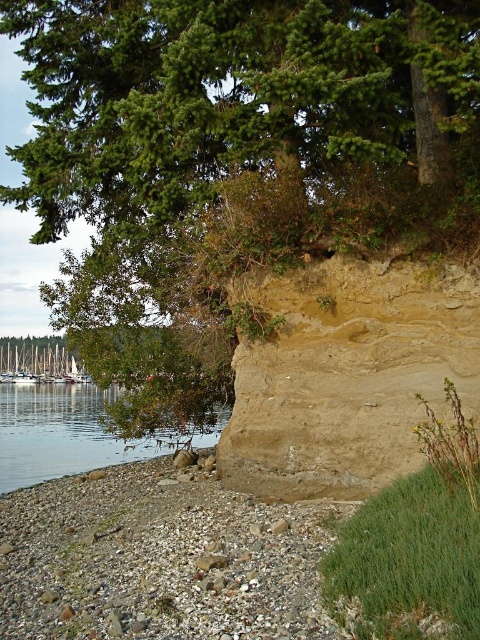
You are standing on the rocky shoreline and want to reach the white wooden boats at lower left. Which direction should you head towards, considering the brown sandy cliff at center is blocking your path?

The brown sandy cliff at center is located above the white wooden boats at lower left, so you should head towards the lower left direction to avoid the cliff and reach the boats.

Based on the photo, you are a photographer planning to capture the white wooden boats at lower left and the green leafy tree at upper left in the same frame. Based on their sizes in the image, which object would appear larger in your photo?

The white wooden boats at lower left appear larger than the green leafy tree at upper left in the image.

You are standing on the rocky shoreline and want to take a photo of the brown sandy cliff at center and the greenish water at lower left. Based on their positions, which object should you frame first in your camera viewfinder to ensure both are captured in the same shot?

You should frame the greenish water at lower left first because the brown sandy cliff at center is to the right of it, so by starting with the water on the left, you can adjust your viewfinder to include both objects in the frame.